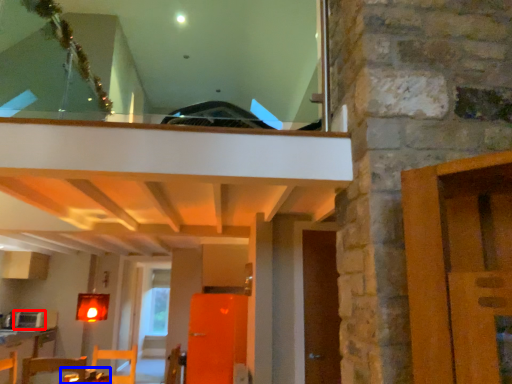
Question: Which object is further to the camera taking this photo, appliance (highlighted by a red box) or table (highlighted by a blue box)?

Choices:
 (A) appliance
 (B) table

Answer: (A)